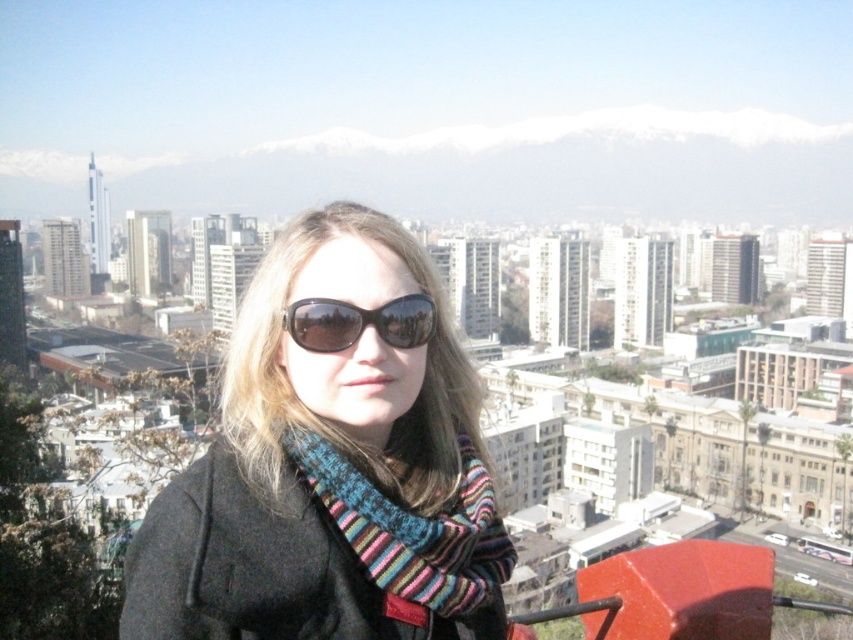
Between black knitted scarf at center and black plastic sunglasses at center, which one is positioned higher?

Positioned higher is black plastic sunglasses at center.

Measure the distance from black knitted scarf at center to black plastic sunglasses at center.

black knitted scarf at center and black plastic sunglasses at center are 10.91 meters apart from each other.

Who is more distant from viewer, (328, 388) or (397, 339)?

Positioned behind is point (397, 339).

Locate an element on the screen. black knitted scarf at center is located at coordinates (332, 461).

Does striped knit scarf at center have a lesser height compared to black plastic sunglasses at center?

In fact, striped knit scarf at center may be taller than black plastic sunglasses at center.

Is striped knit scarf at center to the right of black plastic sunglasses at center from the viewer's perspective?

Yes, striped knit scarf at center is to the right of black plastic sunglasses at center.

Who is more distant from viewer, (450, 609) or (306, 348)?

Point (306, 348)

The width and height of the screenshot is (853, 640). What are the coordinates of `striped knit scarf at center` in the screenshot? It's located at (413, 529).

Looking at this image, is black knitted scarf at center smaller than striped knit scarf at center?

No, black knitted scarf at center is not smaller than striped knit scarf at center.

Does point (361, 454) come behind point (434, 612)?

Yes, point (361, 454) is behind point (434, 612).

What do you see at coordinates (332, 461) in the screenshot? This screenshot has width=853, height=640. I see `black knitted scarf at center` at bounding box center [332, 461].

Identify the location of black knitted scarf at center. (332, 461).